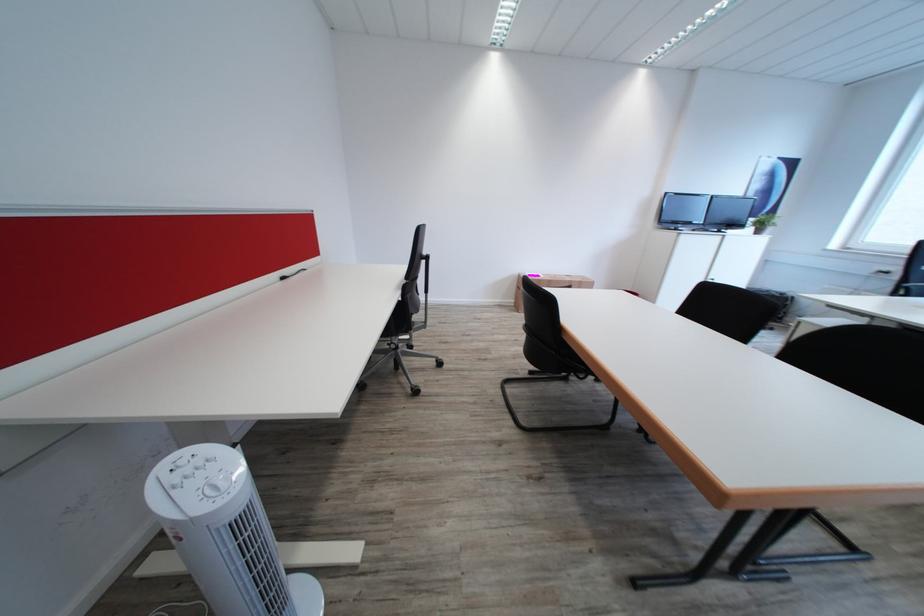
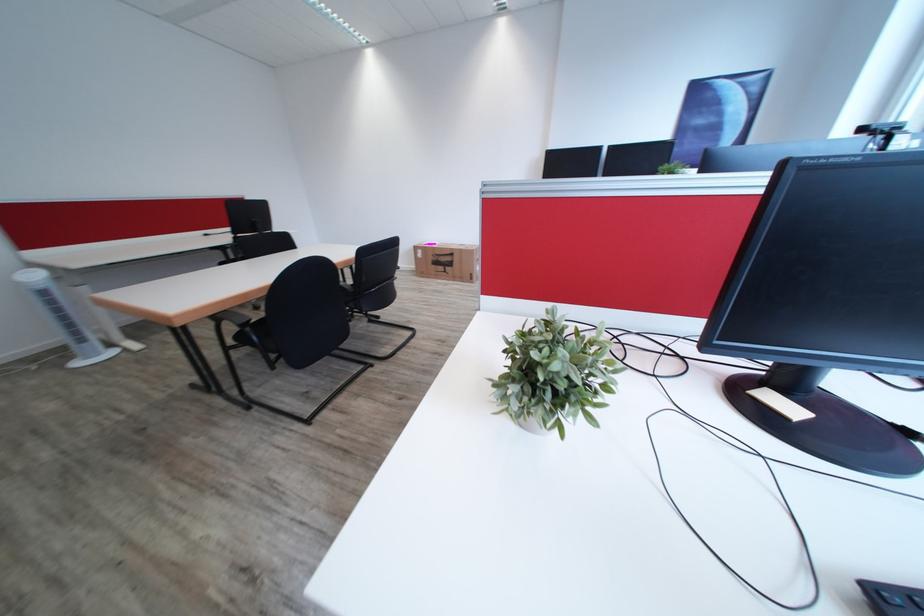
Question: In a continuous first-person perspective shot, in which direction is the camera moving?

Choices:
 (A) Left
 (B) Right
 (C) Forward
 (D) Backward

Answer: (B)